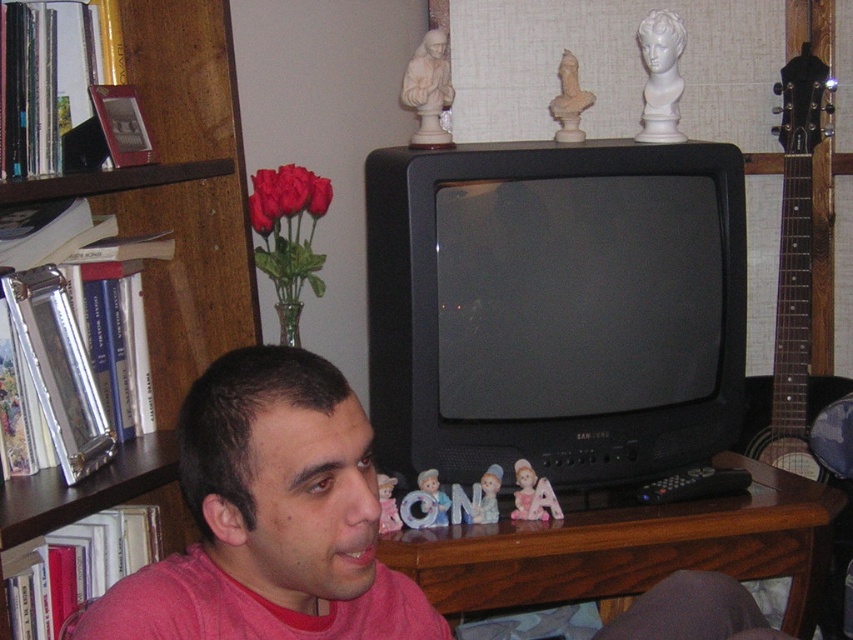
Question: Does white glossy bust at upper center have a lesser width compared to porcelain doll at center?

Choices:
 (A) yes
 (B) no

Answer: (B)

Question: Among these objects, which one is farthest from the camera?

Choices:
 (A) pink matte shirt at center
 (B) white glossy bust at upper center
 (C) porcelain figurine at center
 (D) white marble statue at upper center

Answer: (B)

Question: Does porcelain doll at center appear over porcelain figurine at center?

Choices:
 (A) yes
 (B) no

Answer: (A)

Question: Which point is closer to the camera?

Choices:
 (A) porcelain doll at center
 (B) wooden bookshelf at left
 (C) matte plastic doll at center
 (D) pink fabric doll at center

Answer: (B)

Question: Based on their relative distances, which object is nearer to the porcelain figurine at center?

Choices:
 (A) matte plastic doll at center
 (B) white marble statue at upper center
 (C) white glossy bust at upper center

Answer: (A)

Question: Can you confirm if wooden bookshelf at left is smaller than pink fabric doll at center?

Choices:
 (A) no
 (B) yes

Answer: (A)